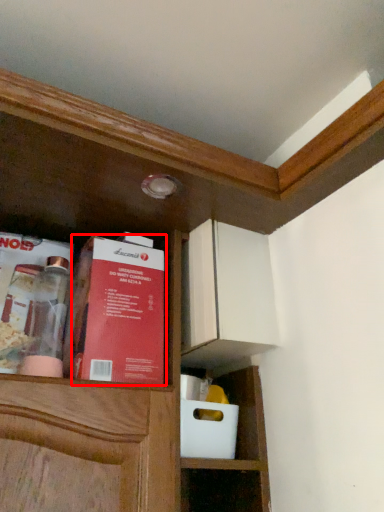
Question: From the image's perspective, considering the relative positions of book (annotated by the red box) and book in the image provided, where is book (annotated by the red box) located with respect to the staircase?

Choices:
 (A) above
 (B) below

Answer: (B)